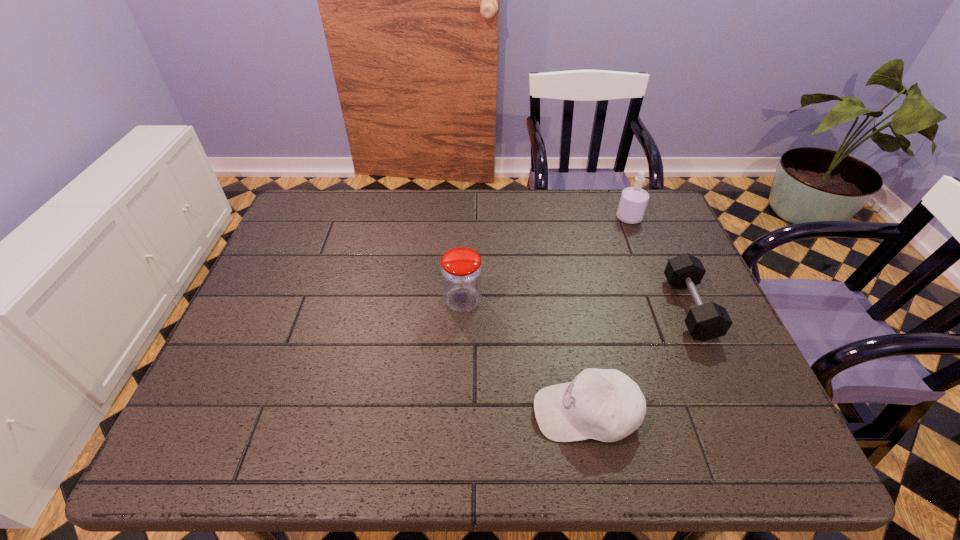
This screenshot has width=960, height=540. I want to click on vacant region located 0.220m on the left of the dumbbell, so click(587, 308).

You are a GUI agent. You are given a task and a screenshot of the screen. Output one action in this format:
    pyautogui.click(x=<x>, y=<y>)
    Task: Click on the object located at the far edge
    
    Given the screenshot: What is the action you would take?
    pyautogui.click(x=633, y=201)

This screenshot has width=960, height=540. I want to click on object at the near edge, so click(x=603, y=404).

The width and height of the screenshot is (960, 540). What are the coordinates of `perfume at the right edge` in the screenshot? It's located at (633, 201).

Locate an element on the screen. The image size is (960, 540). dumbbell located at the right edge is located at coordinates (707, 321).

The width and height of the screenshot is (960, 540). What are the coordinates of `object at the far right corner` in the screenshot? It's located at (633, 201).

Where is `vacant space at the far edge of the desktop`? Image resolution: width=960 pixels, height=540 pixels. vacant space at the far edge of the desktop is located at coordinates (359, 219).

Image resolution: width=960 pixels, height=540 pixels. I want to click on free spot at the near edge of the desktop, so click(529, 421).

Identify the location of free space at the left edge of the desktop. Image resolution: width=960 pixels, height=540 pixels. (x=274, y=254).

Where is `vacant region at the right edge of the desktop`? This screenshot has height=540, width=960. vacant region at the right edge of the desktop is located at coordinates click(x=662, y=291).